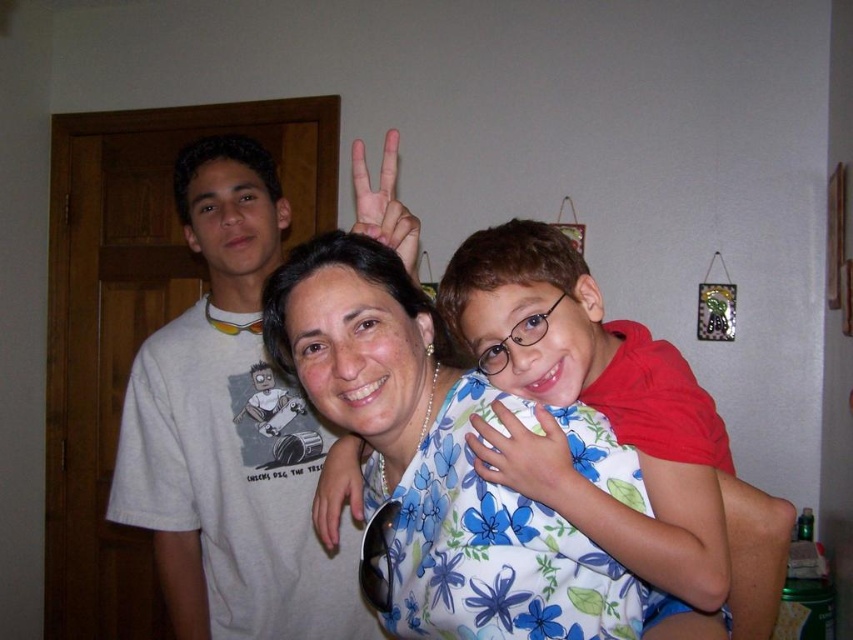
You are a photographer setting up for a family portrait. You need to ensure that the floral fabric shirt at center and the matte black sunglasses at center are visible in the frame. Given that your camera has a minimum focus distance of 15 centimeters, will both items be in focus?

The floral fabric shirt at center is 18.55 centimeters from matte black sunglasses at center. Since the distance between them is greater than the camera minimum focus distance of 15 centimeters, both items will be in focus.

You are a photographer setting up a shoot in this room. You need to place a small prop between the floral fabric shirt at center and the matte black sunglasses at center. Considering their sizes, which object should the prop be closer to?

The prop should be placed closer to the matte black sunglasses at center because the floral fabric shirt at center is larger in size than the matte black sunglasses at center, so the sunglasses are smaller and the prop can be positioned nearer to them without overwhelming the composition.

Based on the scene description, where is the floral fabric hand at center located in terms of coordinates?

The floral fabric hand at center is located at coordinates point (529, 460).